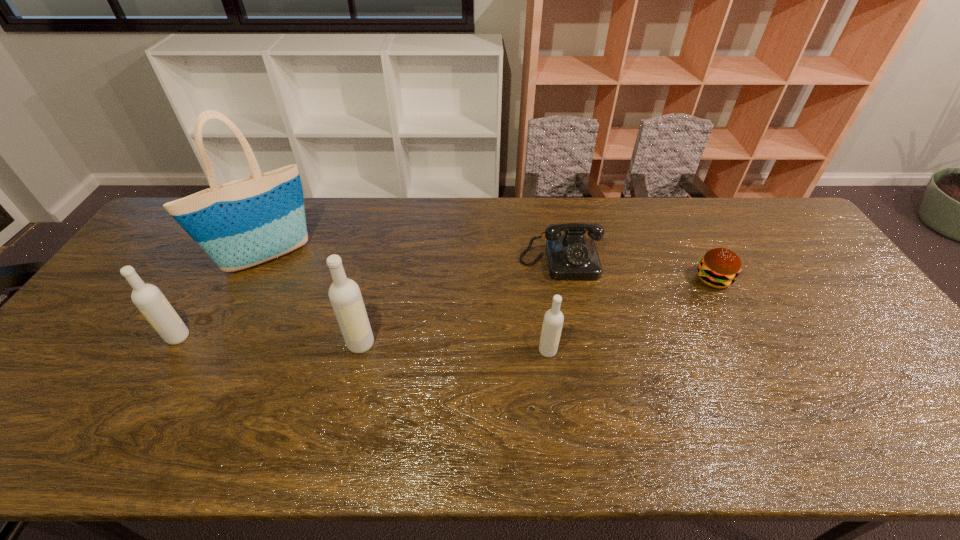
The width and height of the screenshot is (960, 540). Find the location of `the leftmost vodka`. the leftmost vodka is located at coordinates (148, 298).

Locate an element on the screen. Image resolution: width=960 pixels, height=540 pixels. the third tallest object is located at coordinates (148, 298).

You are a GUI agent. You are given a task and a screenshot of the screen. Output one action in this format:
    pyautogui.click(x=<x>, y=<y>)
    Task: Click on the second tallest object
    This screenshot has height=540, width=960.
    Given the screenshot: What is the action you would take?
    [x=344, y=293]

The width and height of the screenshot is (960, 540). In order to click on the third object from left to right in this screenshot , I will do `click(344, 293)`.

The image size is (960, 540). What are the coordinates of `the rightmost vodka` in the screenshot? It's located at (553, 319).

Identify the location of the shortest vodka. The height and width of the screenshot is (540, 960). (553, 319).

Where is `the rightmost object`? The image size is (960, 540). the rightmost object is located at coordinates (719, 267).

At what (x,y) coordinates should I click in order to perform the action: click on the shortest object. Please return your answer as a coordinate pair (x, y). Looking at the image, I should click on (719, 267).

Where is `the tallest object`? This screenshot has width=960, height=540. the tallest object is located at coordinates [249, 221].

Locate an element on the screen. Image resolution: width=960 pixels, height=540 pixels. telephone is located at coordinates [570, 256].